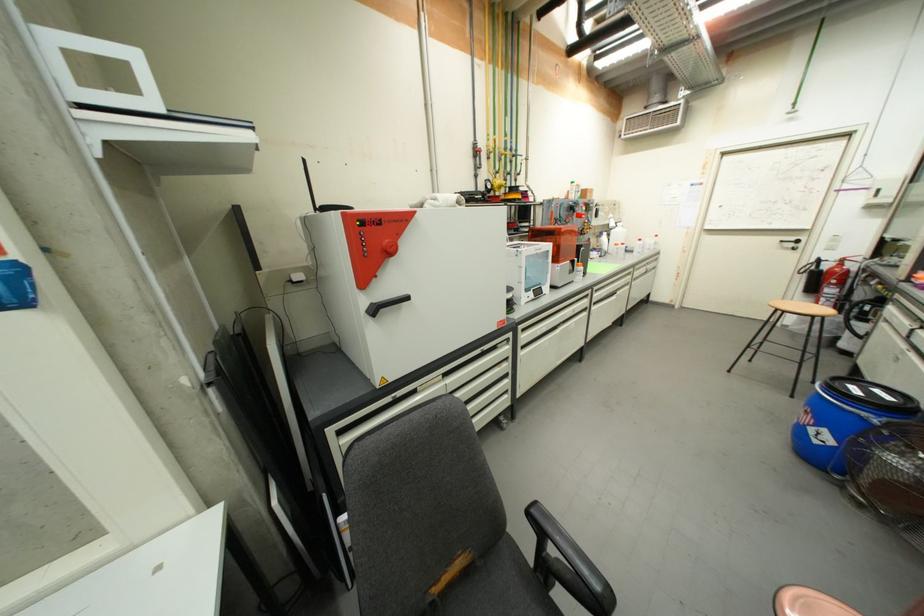
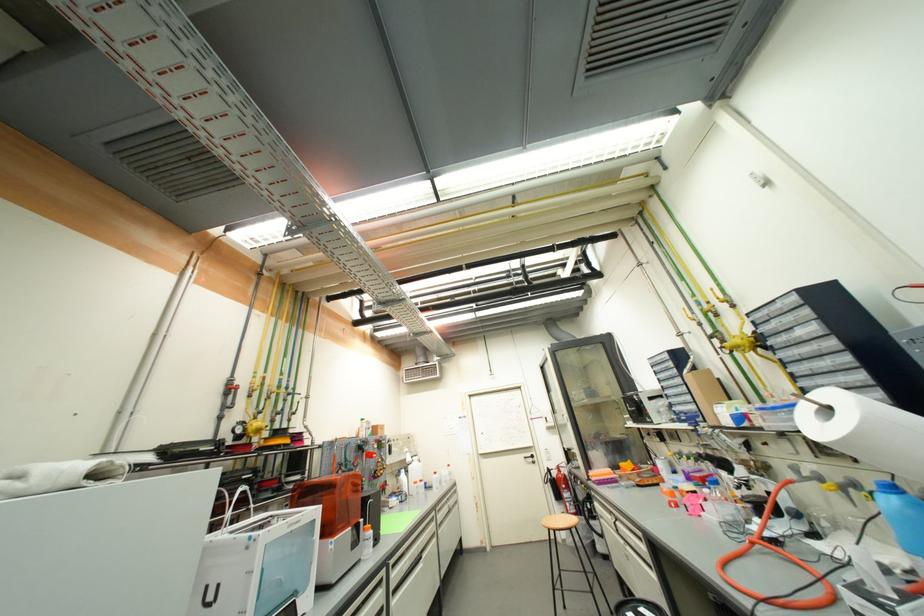
The point at (599,302) is marked in the first image. Where is the corresponding point in the second image?

(396, 590)